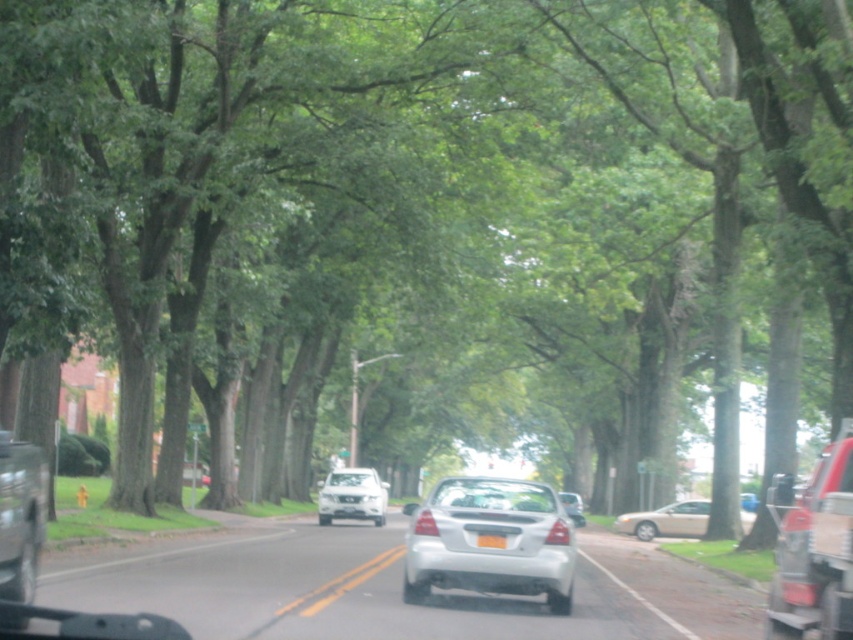
The width and height of the screenshot is (853, 640). In order to click on silver metallic sedan at center in this screenshot , I will do `click(20, 516)`.

Between point (42, 470) and point (366, 492), which one is positioned in front?

Point (42, 470) is in front.

This screenshot has width=853, height=640. I want to click on silver metallic sedan at center, so click(20, 516).

Who is higher up, white matte sedan at center or smooth asphalt road at center?

smooth asphalt road at center is higher up.

Find the location of a particular element. The width and height of the screenshot is (853, 640). white matte sedan at center is located at coordinates (352, 493).

Is white plastic license plate at center taller than metallic silver sedan at center?

No, white plastic license plate at center is not taller than metallic silver sedan at center.

This screenshot has width=853, height=640. What are the coordinates of `white plastic license plate at center` in the screenshot? It's located at (491, 540).

The height and width of the screenshot is (640, 853). I want to click on white plastic license plate at center, so click(x=491, y=540).